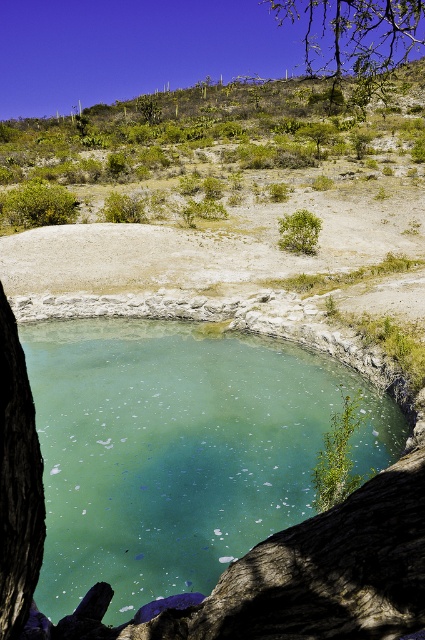
Does point (393, 406) come farther from viewer compared to point (308, 51)?

No, (393, 406) is in front of (308, 51).

Does green translucent water at center have a smaller size compared to green leafy tree at upper right?

Indeed, green translucent water at center has a smaller size compared to green leafy tree at upper right.

Where is `green translucent water at center`? The image size is (425, 640). green translucent water at center is located at coordinates (178, 451).

Does green translucent water at center have a lesser height compared to green leafy bush at center?

No.

Is green translucent water at center behind green leafy bush at center?

No, it is in front of green leafy bush at center.

Locate an element on the screen. The width and height of the screenshot is (425, 640). green translucent water at center is located at coordinates (178, 451).

Consider the image. Does dark brown textured tree trunk at left have a lesser width compared to green leafy tree at upper right?

Yes, dark brown textured tree trunk at left is thinner than green leafy tree at upper right.

Between dark brown textured tree trunk at left and green leafy tree at upper right, which one appears on the left side from the viewer's perspective?

Positioned to the left is dark brown textured tree trunk at left.

Image resolution: width=425 pixels, height=640 pixels. Describe the element at coordinates (17, 483) in the screenshot. I see `dark brown textured tree trunk at left` at that location.

Identify the location of dark brown textured tree trunk at left. This screenshot has width=425, height=640. (17, 483).